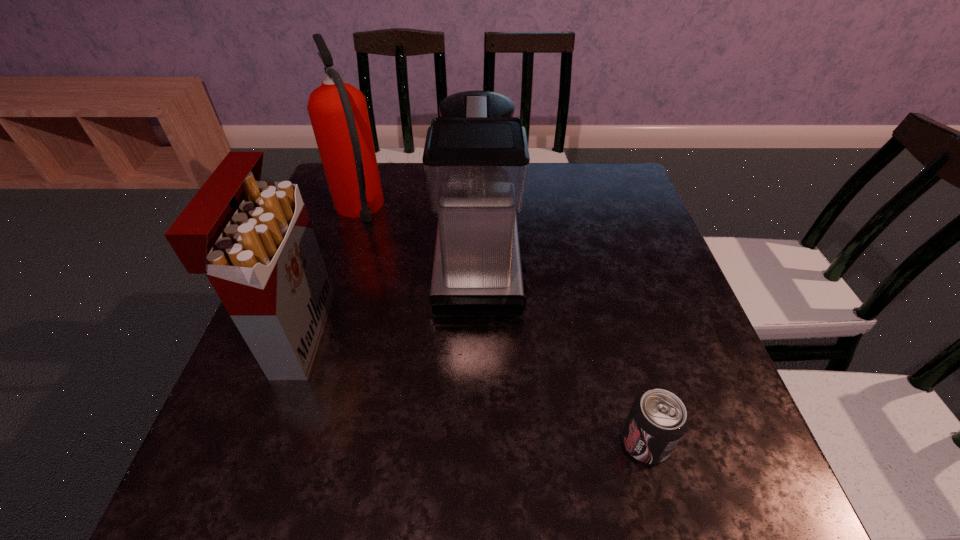
The image size is (960, 540). Find the location of `free spot between the fire extinguisher and the cigarette case`. free spot between the fire extinguisher and the cigarette case is located at coordinates (328, 272).

I want to click on free space that is in between the fire extinguisher and the cigarette case, so click(x=328, y=272).

Where is `vacant point located between the fire extinguisher and the coffee maker`? This screenshot has height=540, width=960. vacant point located between the fire extinguisher and the coffee maker is located at coordinates (419, 237).

At what (x,y) coordinates should I click in order to perform the action: click on vacant space that's between the cigarette case and the nearest object. Please return your answer as a coordinate pair (x, y). The height and width of the screenshot is (540, 960). Looking at the image, I should click on (471, 388).

Locate an element on the screen. The width and height of the screenshot is (960, 540). object that is the second closest one to the rightmost object is located at coordinates (254, 240).

Locate which object ranks third in proximity to the third object from left to right. Please provide its 2D coordinates. Your answer should be formatted as a tuple, i.e. [(x, y)], where the tuple contains the x and y coordinates of a point satisfying the conditions above.

[(657, 420)]

Image resolution: width=960 pixels, height=540 pixels. I want to click on blank space that satisfies the following two spatial constraints: 1. on the back side of the shortest object; 2. at the front of the coffee maker where the controls are located, so click(x=596, y=264).

The image size is (960, 540). Identify the location of free spot that satisfies the following two spatial constraints: 1. on the back side of the soda can; 2. at the front of the third object from left to right where the controls are located. (596, 264).

The height and width of the screenshot is (540, 960). Find the location of `free space that satisfies the following two spatial constraints: 1. on the back side of the shortest object; 2. with the lid open on the cigarette case`. free space that satisfies the following two spatial constraints: 1. on the back side of the shortest object; 2. with the lid open on the cigarette case is located at coordinates (615, 334).